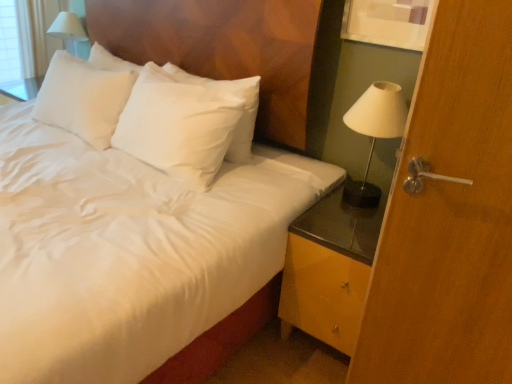
You are a GUI agent. You are given a task and a screenshot of the screen. Output one action in this format:
    pyautogui.click(x=<x>, y=<y>)
    Task: Click on the free spot above yellow glossy nightstand at lower right (from a real-world perspective)
    This screenshot has height=384, width=512.
    Given the screenshot: What is the action you would take?
    pyautogui.click(x=342, y=215)